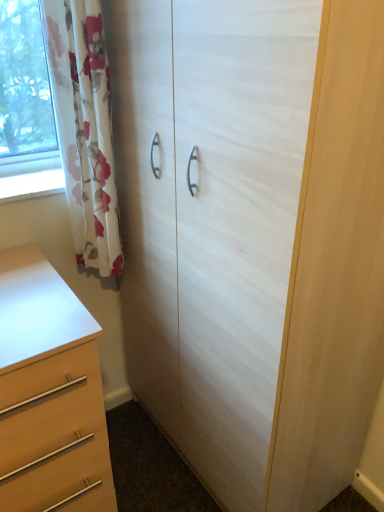
Identify the location of floral fabric curtain at left. (85, 129).

In the scene shown: Is matte wood chest of drawers at lower left facing towards white wood cupboard at center?

No, matte wood chest of drawers at lower left is not turned towards white wood cupboard at center.

Measure the distance from matte wood chest of drawers at lower left to white wood cupboard at center.

matte wood chest of drawers at lower left is 17.26 inches from white wood cupboard at center.

From the image's perspective, is matte wood chest of drawers at lower left located above white wood cupboard at center?

No, from the image's perspective, matte wood chest of drawers at lower left is not above white wood cupboard at center.

Is matte wood chest of drawers at lower left bigger than white wood cupboard at center?

Incorrect, matte wood chest of drawers at lower left is not larger than white wood cupboard at center.

Is floral fabric curtain at left next to matte wood chest of drawers at lower left and touching it?

floral fabric curtain at left and matte wood chest of drawers at lower left are clearly separated.

In the scene shown: Could you tell me if floral fabric curtain at left is facing matte wood chest of drawers at lower left?

No, floral fabric curtain at left is not turned towards matte wood chest of drawers at lower left.

Is floral fabric curtain at left to the left or to the right of matte wood chest of drawers at lower left in the image?

Clearly, floral fabric curtain at left is on the right of matte wood chest of drawers at lower left in the image.

Considering the sizes of objects white wood cupboard at center and floral fabric curtain at left in the image provided, who is bigger, white wood cupboard at center or floral fabric curtain at left?

white wood cupboard at center is bigger.

The image size is (384, 512). What are the coordinates of `cupboard below the floral fabric curtain at left (from the image's perspective)` in the screenshot? It's located at 254,244.

Measure the distance from white wood cupboard at center to floral fabric curtain at left.

white wood cupboard at center and floral fabric curtain at left are 14.60 inches apart from each other.

From a real-world perspective, is white wood cupboard at center positioned above or below floral fabric curtain at left?

white wood cupboard at center is situated lower than floral fabric curtain at left in the real world.

In terms of height, does floral fabric curtain at left look taller or shorter compared to white wood cupboard at center?

floral fabric curtain at left is shorter than white wood cupboard at center.

Is floral fabric curtain at left closer to the viewer compared to white wood cupboard at center?

No, floral fabric curtain at left is further to the viewer.

Considering the relative positions of floral fabric curtain at left and white wood cupboard at center in the image provided, is floral fabric curtain at left to the right of white wood cupboard at center from the viewer's perspective?

In fact, floral fabric curtain at left is to the left of white wood cupboard at center.

Is white wood cupboard at center not close to matte wood chest of drawers at lower left?

That's not correct — white wood cupboard at center is a little close to matte wood chest of drawers at lower left.

From a real-world perspective, is white wood cupboard at center below matte wood chest of drawers at lower left?

No.

Is white wood cupboard at center positioned beyond the bounds of matte wood chest of drawers at lower left?

Yes, white wood cupboard at center is outside of matte wood chest of drawers at lower left.

Is white wood cupboard at center facing away from matte wood chest of drawers at lower left?

white wood cupboard at center does not have its back to matte wood chest of drawers at lower left.

From a real-world perspective, which object rests below the other?

From a 3D spatial view, matte wood chest of drawers at lower left is below.

Who is shorter, matte wood chest of drawers at lower left or floral fabric curtain at left?

matte wood chest of drawers at lower left.

Is matte wood chest of drawers at lower left completely or partially outside of floral fabric curtain at left?

Indeed, matte wood chest of drawers at lower left is completely outside floral fabric curtain at left.

What's the angular difference between matte wood chest of drawers at lower left and floral fabric curtain at left's facing directions?

matte wood chest of drawers at lower left and floral fabric curtain at left are facing 1.59 degrees away from each other.

The width and height of the screenshot is (384, 512). I want to click on the chest of drawers beneath the white wood cupboard at center (from a real-world perspective), so click(49, 393).

Identify the location of chest of drawers on the left of floral fabric curtain at left. The image size is (384, 512). (49, 393).

Estimate the real-world distances between objects in this image. Which object is closer to white wood cupboard at center, matte wood chest of drawers at lower left or floral fabric curtain at left?

Among the two, floral fabric curtain at left is located nearer to white wood cupboard at center.

Looking at this image, considering their positions, is white wood cupboard at center positioned further to floral fabric curtain at left than matte wood chest of drawers at lower left?

Based on the image, matte wood chest of drawers at lower left appears to be further to floral fabric curtain at left.

Which object lies nearer to the anchor point floral fabric curtain at left, matte wood chest of drawers at lower left or white wood cupboard at center?

white wood cupboard at center lies closer to floral fabric curtain at left than the other object.

From the image, which object appears to be nearer to white wood cupboard at center, floral fabric curtain at left or matte wood chest of drawers at lower left?

Among the two, floral fabric curtain at left is located nearer to white wood cupboard at center.

Considering their positions, is white wood cupboard at center positioned further to matte wood chest of drawers at lower left than floral fabric curtain at left?

white wood cupboard at center.

Which object lies further to the anchor point matte wood chest of drawers at lower left, floral fabric curtain at left or white wood cupboard at center?

white wood cupboard at center is further to matte wood chest of drawers at lower left.

In order to click on cupboard between floral fabric curtain at left and matte wood chest of drawers at lower left vertically in this screenshot , I will do pyautogui.click(x=254, y=244).